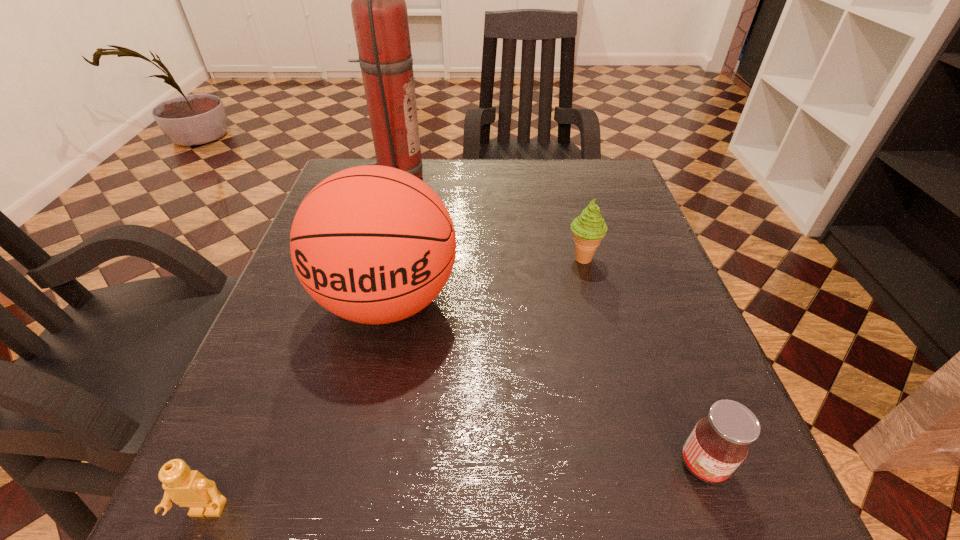
This screenshot has height=540, width=960. Identify the location of vacant space located on the back of the third shortest object. (568, 204).

The width and height of the screenshot is (960, 540). In order to click on object that is positioned at the far edge in this screenshot , I will do `click(379, 12)`.

Find the location of a particular element. jam that is at the near edge is located at coordinates (719, 443).

Where is `Lego situated at the near edge`? The width and height of the screenshot is (960, 540). Lego situated at the near edge is located at coordinates click(189, 488).

The height and width of the screenshot is (540, 960). In order to click on fire extinguisher that is positioned at the left edge in this screenshot , I will do `click(379, 12)`.

Identify the location of basketball that is at the left edge. (372, 244).

The width and height of the screenshot is (960, 540). I want to click on Lego at the left edge, so click(x=189, y=488).

Find the location of a particular element. icecream at the right edge is located at coordinates (589, 228).

Where is `jam positioned at the right edge`? This screenshot has width=960, height=540. jam positioned at the right edge is located at coordinates (719, 443).

Image resolution: width=960 pixels, height=540 pixels. I want to click on object present at the far left corner, so click(379, 12).